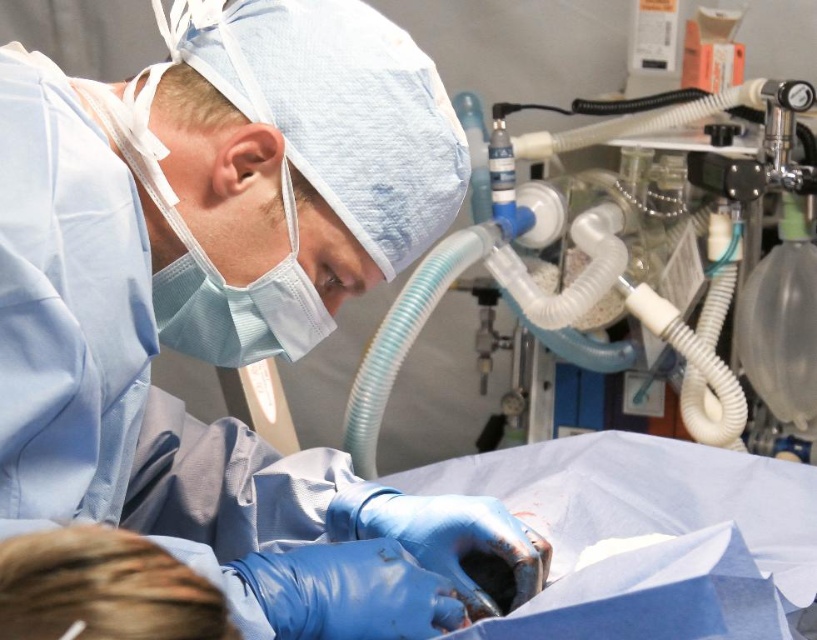
Is point (69, 156) farther from viewer compared to point (795, 189)?

No, it is in front of (795, 189).

Is blue latex gloves at lower center below white rubber tubing at upper right?

Correct, blue latex gloves at lower center is located below white rubber tubing at upper right.

At what (x,y) coordinates should I click in order to perform the action: click on blue latex gloves at lower center. Please return your answer as a coordinate pair (x, y). This screenshot has height=640, width=817. Looking at the image, I should click on (230, 305).

Where is `blue latex gloves at lower center`? blue latex gloves at lower center is located at coordinates point(230,305).